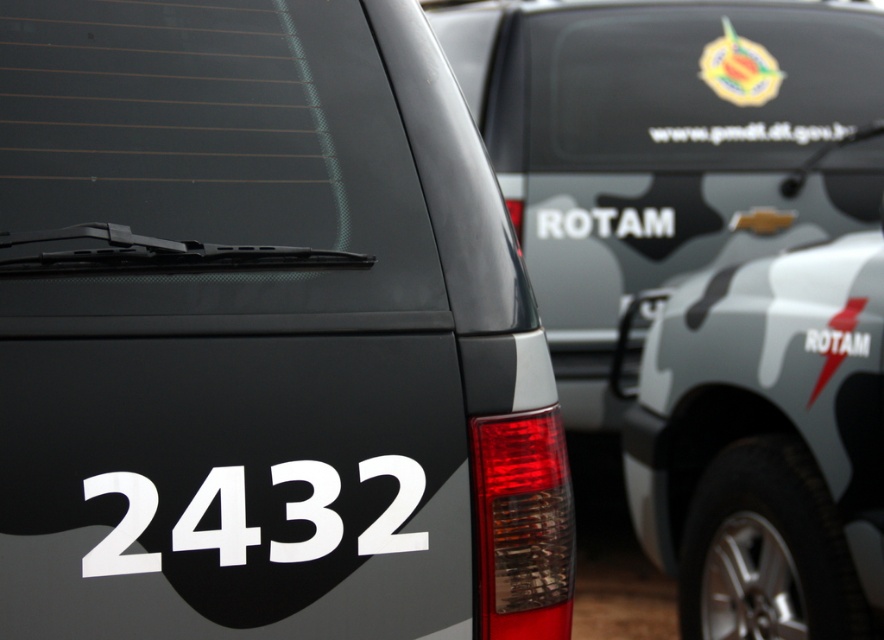
Does matte black vehicle at center have a lesser width compared to white matte text at center?

Correct, matte black vehicle at center's width is less than white matte text at center's.

Which is behind, point (221, 570) or point (842, 131)?

The point (842, 131) is behind.

Who is more forward, (277, 518) or (705, 128)?

Point (277, 518)

This screenshot has height=640, width=884. I want to click on matte black vehicle at center, so click(x=263, y=333).

Which of these two, matte black vehicle at center or metallic emblem at upper right, stands taller?

Standing taller between the two is matte black vehicle at center.

Who is positioned more to the right, matte black vehicle at center or metallic emblem at upper right?

Positioned to the right is metallic emblem at upper right.

Does point (272, 260) come behind point (764, 100)?

No.

Identify the location of matte black vehicle at center. pyautogui.click(x=263, y=333).

Who is positioned more to the right, white matte text at center or white matte license plate at center?

From the viewer's perspective, white matte text at center appears more on the right side.

Does point (677, 140) lie behind point (644, 292)?

That is True.

Locate an element on the screen. Image resolution: width=884 pixels, height=640 pixels. white matte text at center is located at coordinates (751, 132).